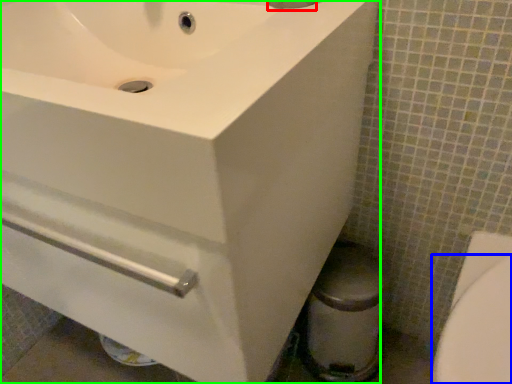
Question: Estimate the real-world distances between objects in this image. Which object is closer to plumbing fixture (highlighted by a red box), bidet (highlighted by a blue box) or sink (highlighted by a green box)?

Choices:
 (A) bidet
 (B) sink

Answer: (B)